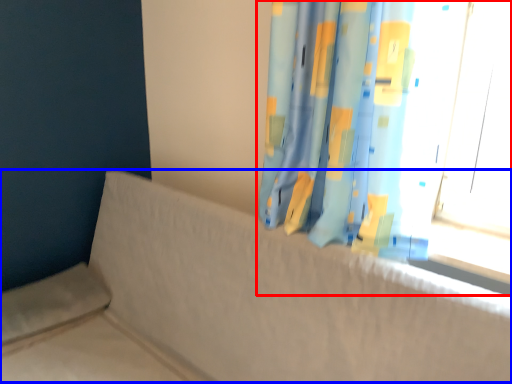
Question: Which point is further to the camera, curtain (highlighted by a red box) or couch (highlighted by a blue box)?

Choices:
 (A) curtain
 (B) couch

Answer: (A)